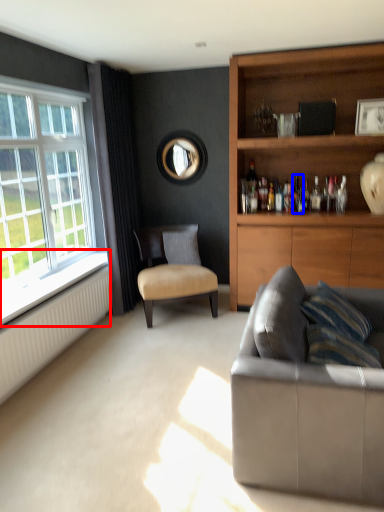
Question: Which point is closer to the camera, window sill (highlighted by a red box) or bottle (highlighted by a blue box)?

Choices:
 (A) window sill
 (B) bottle

Answer: (A)